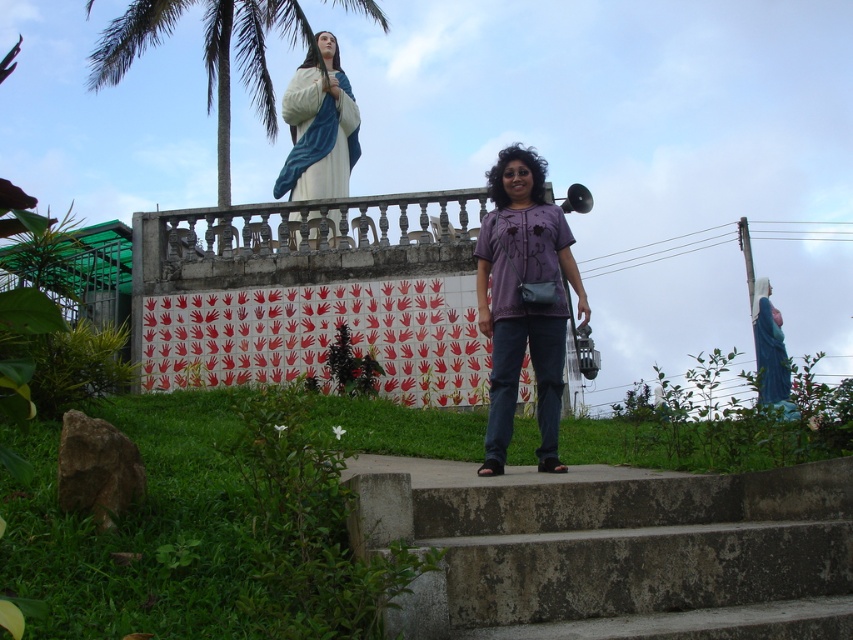
Question: Estimate the real-world distances between objects in this image. Which object is farther from the matte white statue at upper center?

Choices:
 (A) green leafy palm tree at upper left
 (B) concrete stairs at center
 (C) purple cotton shirt at center

Answer: (B)

Question: In this image, where is concrete stairs at center located relative to matte white statue at upper center?

Choices:
 (A) right
 (B) left

Answer: (A)

Question: Observing the image, what is the correct spatial positioning of purple cotton shirt at center in reference to matte white statue at upper center?

Choices:
 (A) left
 (B) right

Answer: (B)

Question: Which object is farther from the camera taking this photo?

Choices:
 (A) matte white statue at upper center
 (B) concrete stairs at center

Answer: (A)

Question: Which point appears closest to the camera in this image?

Choices:
 (A) (219, 161)
 (B) (345, 154)
 (C) (494, 218)

Answer: (C)

Question: Can you confirm if concrete stairs at center is positioned above purple cotton shirt at center?

Choices:
 (A) yes
 (B) no

Answer: (B)